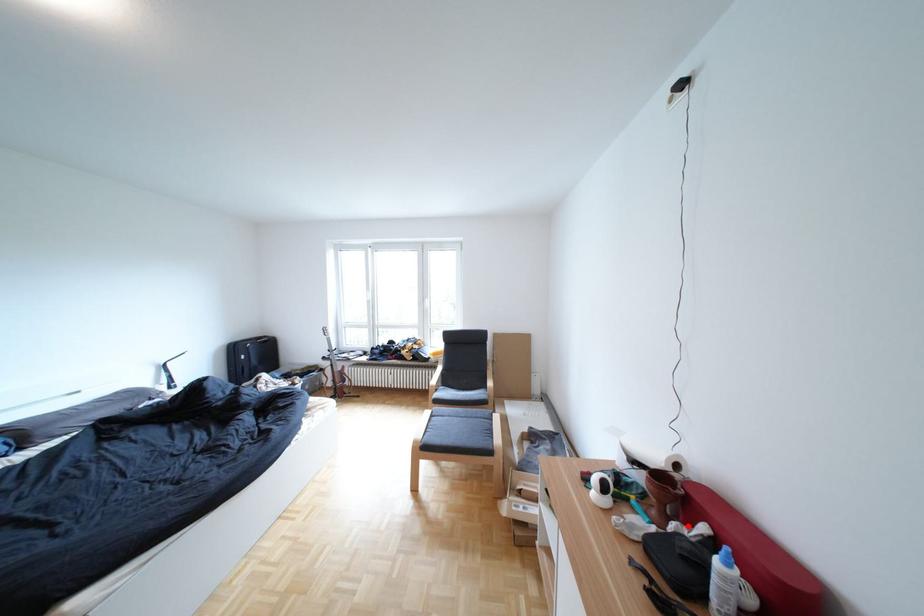
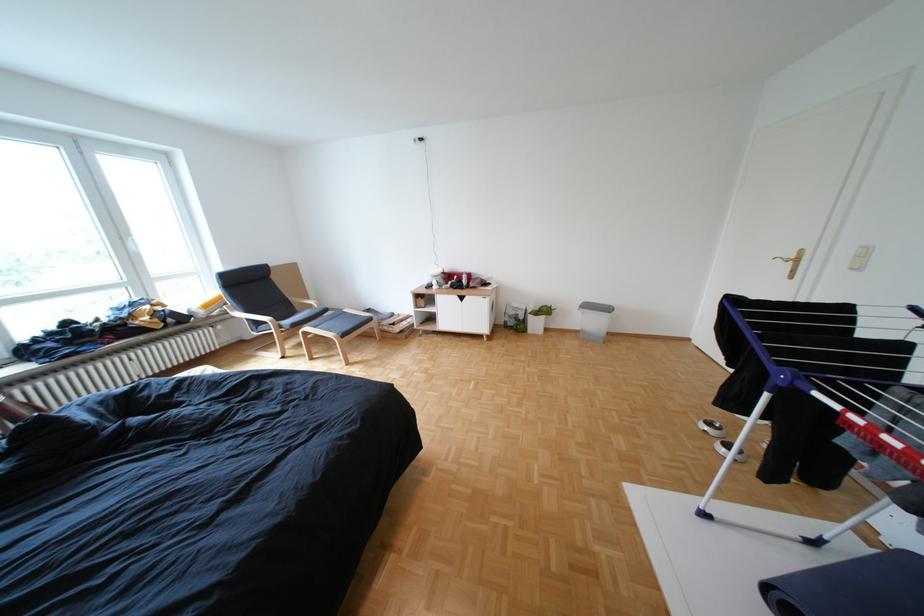
Locate, in the second image, the point that corresponds to the highlighted location in the first image.

(466, 283)